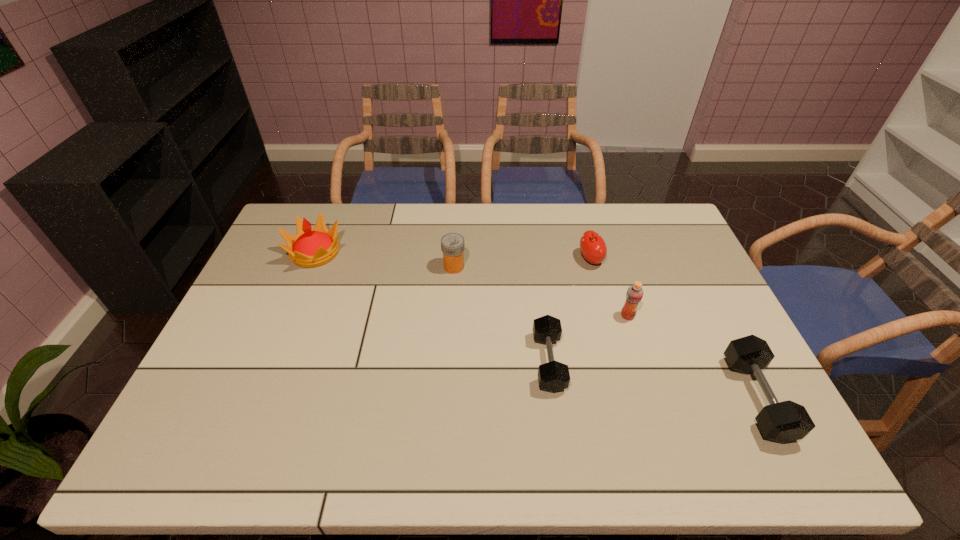
Identify the location of vacant region at the near edge. This screenshot has height=540, width=960. (343, 404).

The width and height of the screenshot is (960, 540). I want to click on free space at the left edge of the desktop, so click(x=269, y=332).

The width and height of the screenshot is (960, 540). In order to click on vacant space at the right edge of the desktop in this screenshot , I will do `click(700, 266)`.

This screenshot has width=960, height=540. Identify the location of vacant region at the far left corner. (300, 213).

This screenshot has height=540, width=960. What are the coordinates of `vacant area at the near left corner of the desktop` in the screenshot? It's located at (201, 421).

You are a GUI agent. You are given a task and a screenshot of the screen. Output one action in this format:
    pyautogui.click(x=<x>, y=<y>)
    Task: Click on the empty space that is in between the second object from left to right and the right dumbbell
    The width and height of the screenshot is (960, 540).
    Given the screenshot: What is the action you would take?
    pyautogui.click(x=605, y=332)

Where is `free area in between the third nearest object and the second object from left to right`? This screenshot has width=960, height=540. free area in between the third nearest object and the second object from left to right is located at coordinates pyautogui.click(x=540, y=292).

Locate an element on the screen. This screenshot has height=540, width=960. free space that is in between the orange juice and the leftmost object is located at coordinates (471, 284).

Where is `empty space that is in between the fourth farthest object and the medicine`? This screenshot has width=960, height=540. empty space that is in between the fourth farthest object and the medicine is located at coordinates (540, 292).

I want to click on free space between the right dumbbell and the second object from left to right, so click(x=605, y=332).